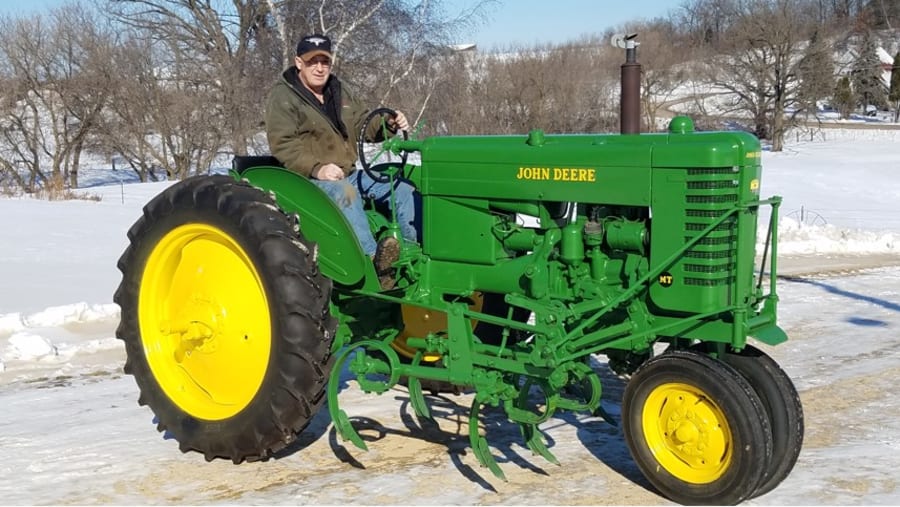
I want to click on coat, so click(x=294, y=126).